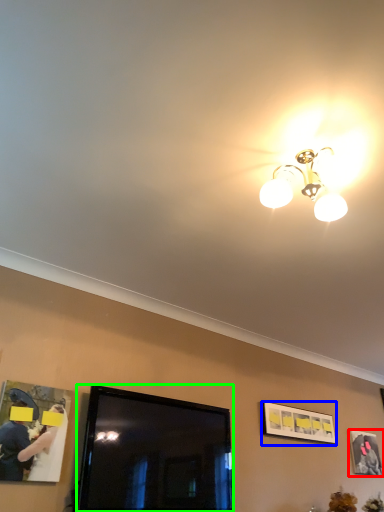
Question: Based on their relative distances, which object is farther from picture frame (highlighted by a red box)? Choose from picture frame (highlighted by a blue box) and television (highlighted by a green box).

Choices:
 (A) picture frame
 (B) television

Answer: (B)